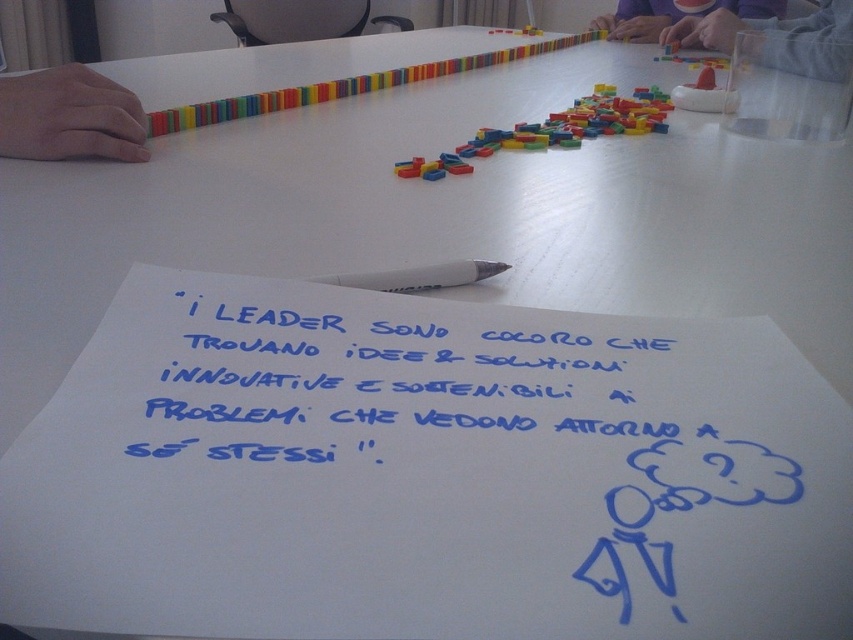
Which is above, matte plastic dominoes at upper center or white plastic pen at center?

Positioned higher is matte plastic dominoes at upper center.

Can you confirm if matte plastic dominoes at upper center is smaller than white plastic pen at center?

Actually, matte plastic dominoes at upper center might be larger than white plastic pen at center.

Which is behind, point (694, 16) or point (440, 266)?

The point (694, 16) is behind.

Locate an element on the screen. matte plastic dominoes at upper center is located at coordinates tap(675, 16).

Looking at this image, who is taller, blue ink writing at center or white plastic pen at center?

blue ink writing at center is taller.

What do you see at coordinates (381, 378) in the screenshot? Image resolution: width=853 pixels, height=640 pixels. I see `blue ink writing at center` at bounding box center [381, 378].

What do you see at coordinates (381, 378) in the screenshot? I see `blue ink writing at center` at bounding box center [381, 378].

I want to click on blue ink writing at center, so click(x=381, y=378).

Is blue ink writing at center thinner than matte plastic cup at upper right?

Yes.

Can you confirm if blue ink writing at center is bigger than matte plastic cup at upper right?

Actually, blue ink writing at center might be smaller than matte plastic cup at upper right.

Identify the location of blue ink writing at center. (381, 378).

Where is `blue ink writing at center`? The width and height of the screenshot is (853, 640). blue ink writing at center is located at coordinates (381, 378).